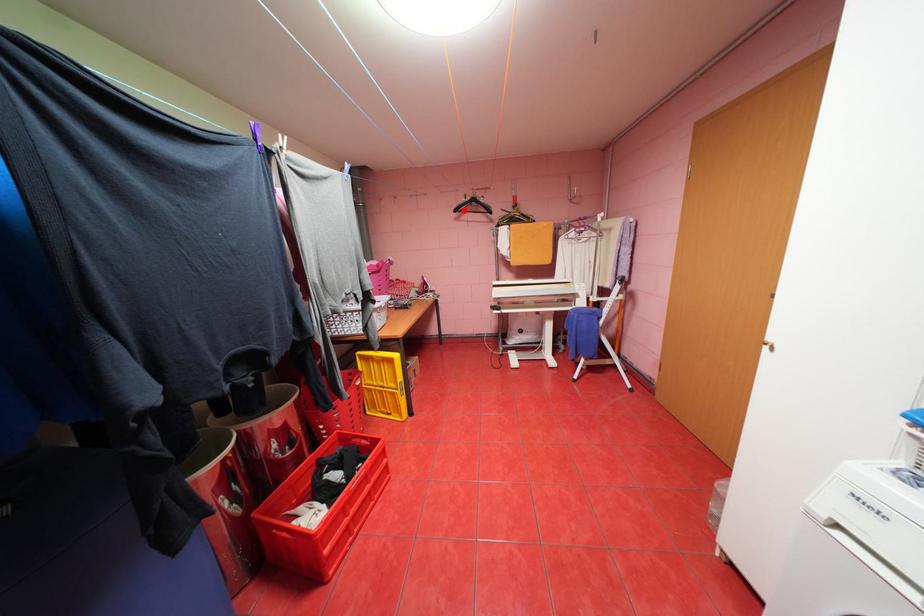
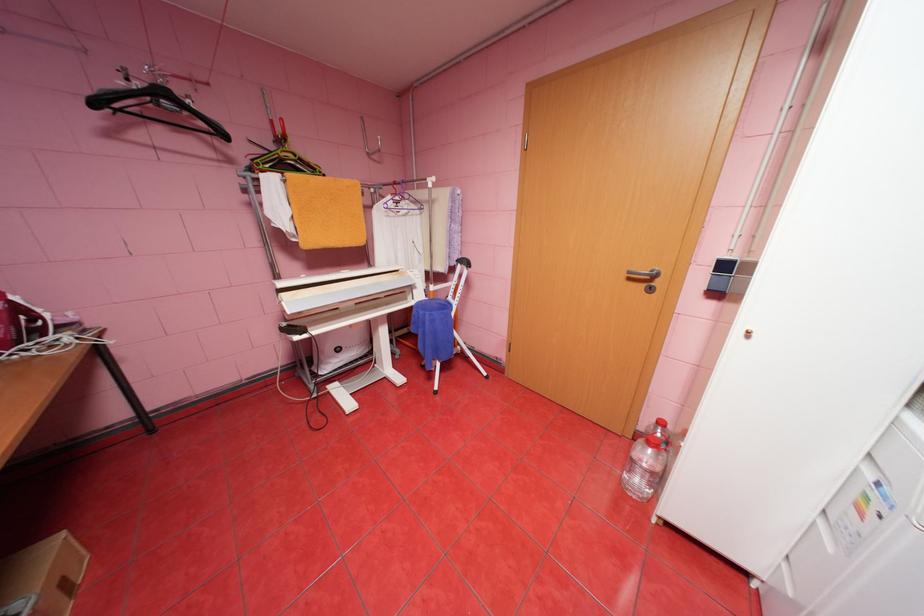
In the second image, find the point that corresponds to the highlighted location in the first image.

(103, 103)